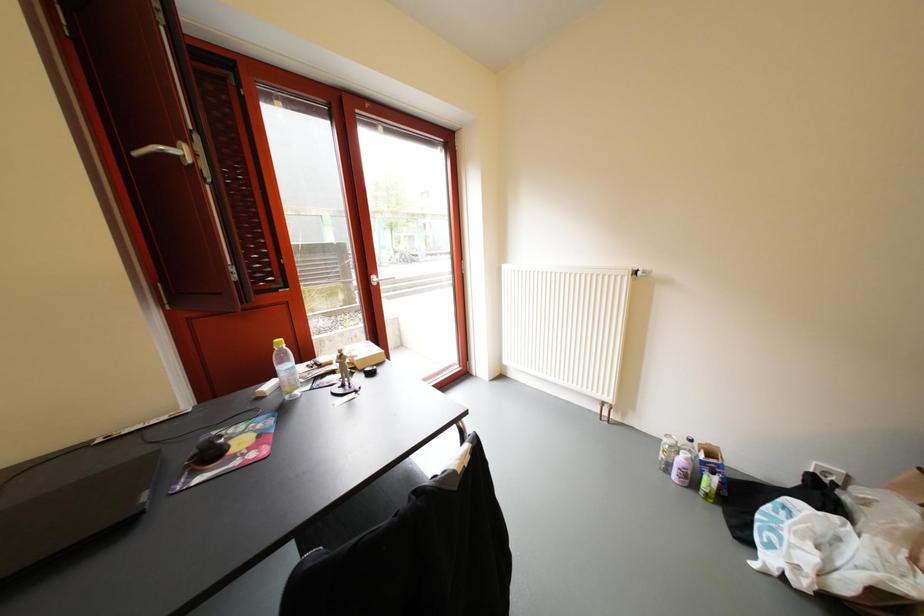
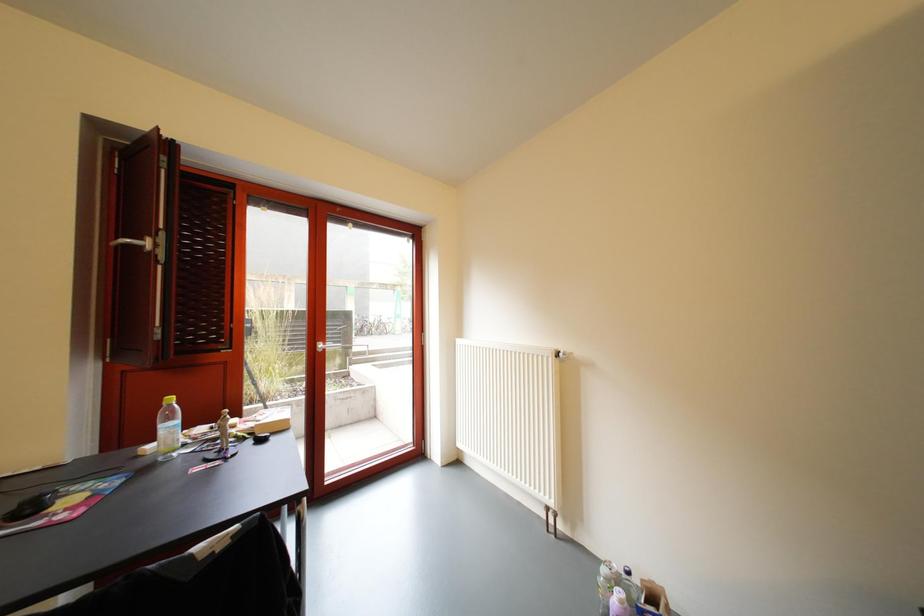
Question: The images are taken continuously from a first-person perspective. In which direction is your viewpoint rotating?

Choices:
 (A) Left
 (B) Right
 (C) Up
 (D) Down

Answer: (C)